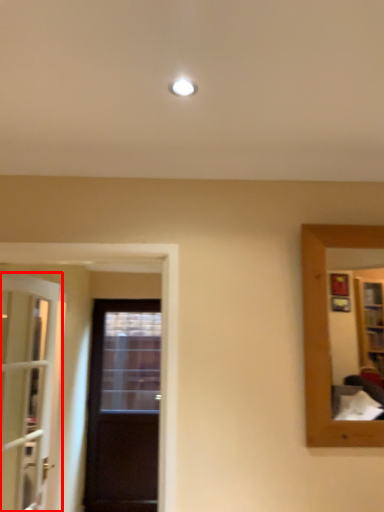
Question: Observing the image, what is the correct spatial positioning of door (annotated by the red box) in reference to door?

Choices:
 (A) left
 (B) right

Answer: (A)